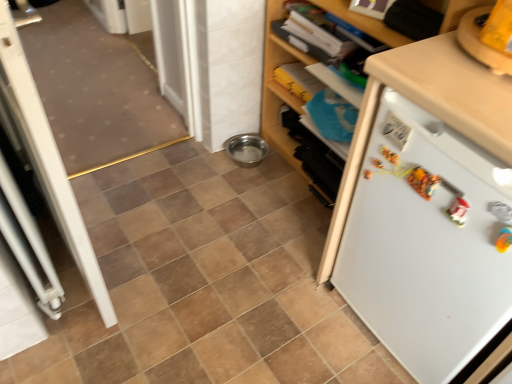
I want to click on vacant area on the back side of white plastic screen door at left, so [x=136, y=199].